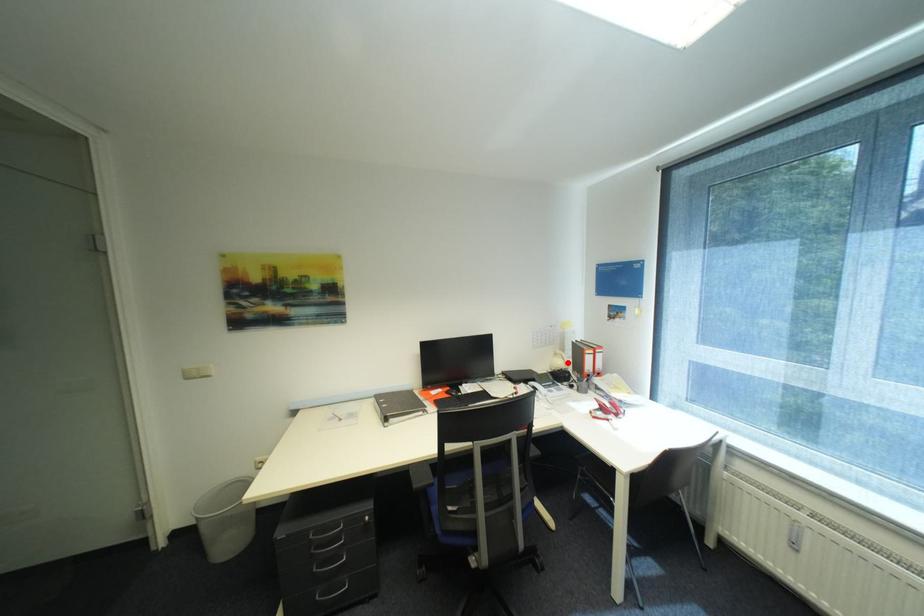
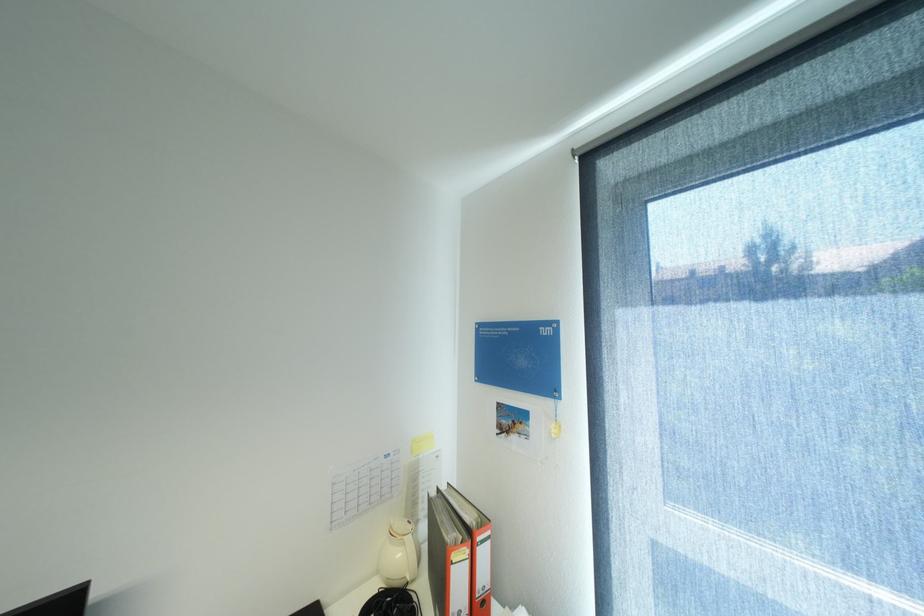
In the second image, find the point that corresponds to the highlighted location in the first image.

(407, 554)